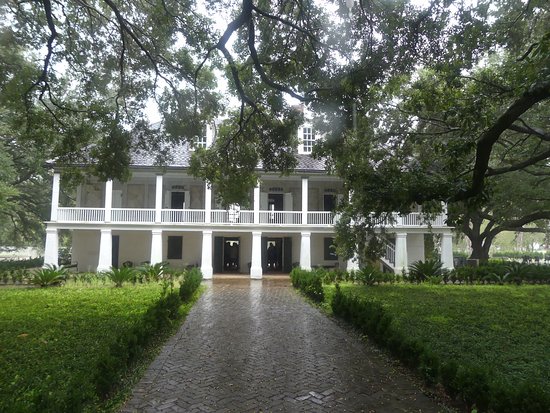
Locate an element on the screen. Image resolution: width=550 pixels, height=413 pixels. lower pillars is located at coordinates (207, 248), (258, 252).